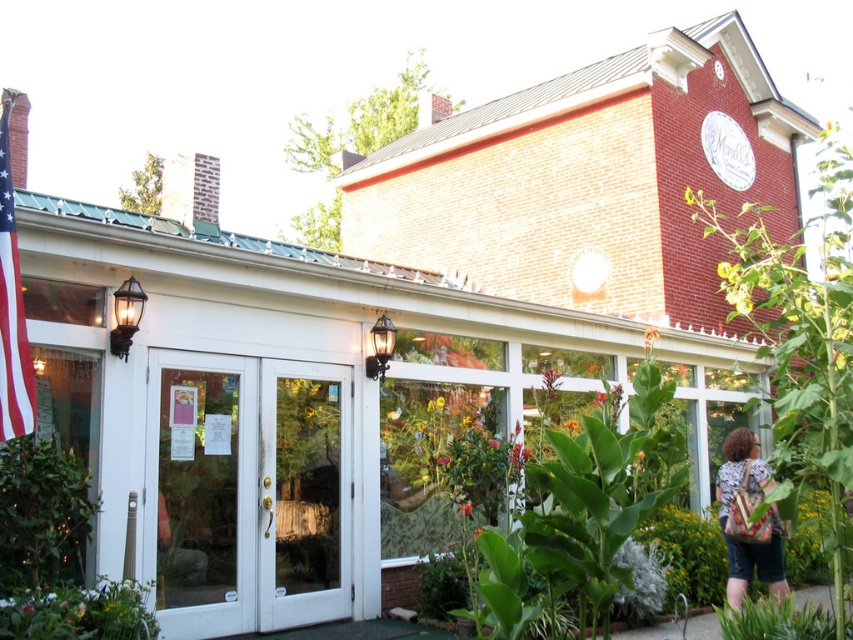
You are a customer standing in front of the entrance of the building. You notice a red fabric flag at left and a green leafy plant at center. Which object is bigger in size?

The red fabric flag at left has a larger size compared to the green leafy plant at center, so the red fabric flag at left is bigger.

You are standing in front of the building and want to hang a new red fabric flag at left. However, there is already a green leafy plant at center. Based on their positions, which object is higher up?

The red fabric flag at left is located above the green leafy plant at center, so the red fabric flag at left is higher up.

From the picture: You are a customer standing in front of the building and see the red fabric flag at left and the patterned fabric bag at right. Which object is shorter?

The red fabric flag at left is shorter than the patterned fabric bag at right.